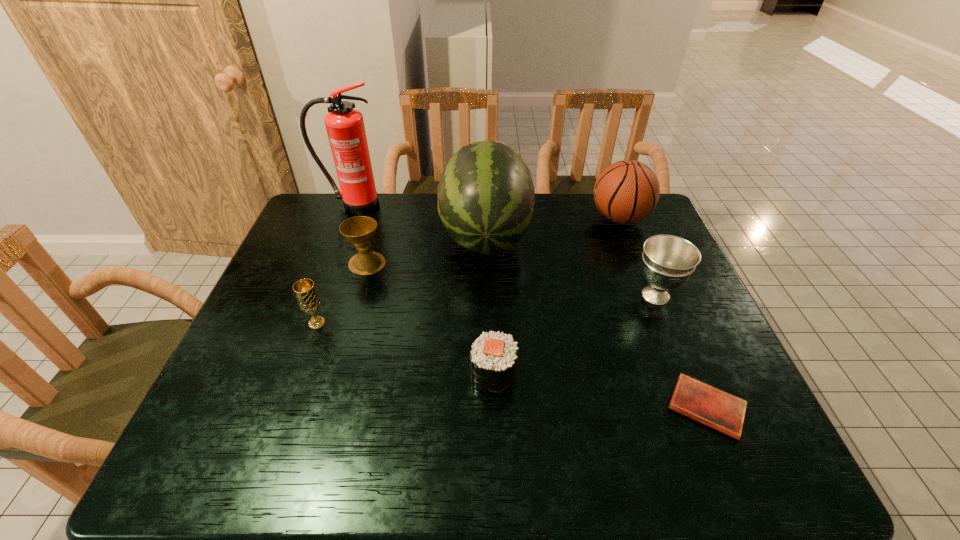
Where is `fire extinguisher that is positioned at the far edge`? fire extinguisher that is positioned at the far edge is located at coordinates (345, 127).

Find the location of a particular element. The height and width of the screenshot is (540, 960). watermelon that is at the far edge is located at coordinates (486, 195).

Find the location of a particular element. The width and height of the screenshot is (960, 540). basketball positioned at the far edge is located at coordinates (627, 191).

Locate an element on the screen. The height and width of the screenshot is (540, 960). object at the near edge is located at coordinates (724, 412).

This screenshot has height=540, width=960. Identify the location of fire extinguisher situated at the left edge. (345, 127).

Image resolution: width=960 pixels, height=540 pixels. In order to click on chalice located in the left edge section of the desktop in this screenshot , I will do `click(308, 299)`.

You are a GUI agent. You are given a task and a screenshot of the screen. Output one action in this format:
    pyautogui.click(x=<x>, y=<y>)
    Task: Click on the basketball that is at the right edge
    The height and width of the screenshot is (540, 960).
    Given the screenshot: What is the action you would take?
    pyautogui.click(x=627, y=191)

Identify the location of chalice located in the right edge section of the desktop. The width and height of the screenshot is (960, 540). (668, 261).

At what (x,y) coordinates should I click in order to perform the action: click on diary located at the right edge. Please return your answer as a coordinate pair (x, y). This screenshot has width=960, height=540. Looking at the image, I should click on click(724, 412).

In order to click on object that is at the far left corner in this screenshot , I will do `click(345, 127)`.